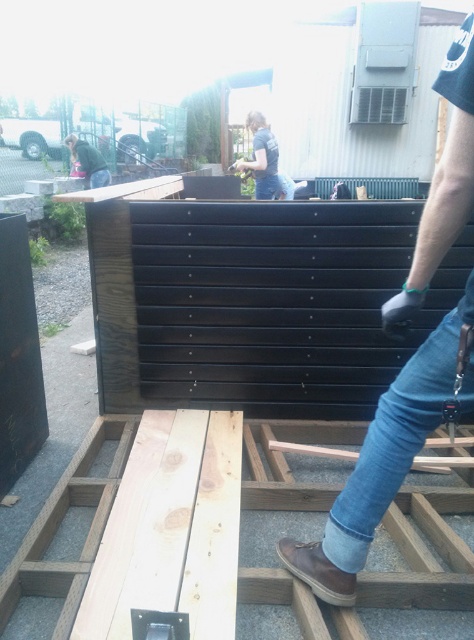
Consider the image. Does jeans at center have a greater height compared to green fabric jacket at upper left?

Correct, jeans at center is much taller as green fabric jacket at upper left.

Where is `jeans at center`? The image size is (474, 640). jeans at center is located at coordinates (382, 461).

The width and height of the screenshot is (474, 640). Identify the location of jeans at center. (382, 461).

You are a GUI agent. You are given a task and a screenshot of the screen. Output one action in this format:
    pyautogui.click(x=<x>, y=<y>)
    Task: Click on the jeans at center
    Image resolution: width=474 pixels, height=640 pixels.
    Given the screenshot: What is the action you would take?
    pyautogui.click(x=382, y=461)

Does jeans at center appear on the left side of denim jeans at upper center?

No, jeans at center is not to the left of denim jeans at upper center.

Who is more forward, (455, 209) or (266, 131)?

Positioned in front is point (455, 209).

Image resolution: width=474 pixels, height=640 pixels. In order to click on jeans at center in this screenshot , I will do `click(382, 461)`.

From the picture: Can you confirm if denim jeans at upper center is wider than green fabric jacket at upper left?

Incorrect, denim jeans at upper center's width does not surpass green fabric jacket at upper left's.

Who is positioned more to the right, denim jeans at upper center or green fabric jacket at upper left?

Positioned to the right is denim jeans at upper center.

Locate an element on the screen. The image size is (474, 640). denim jeans at upper center is located at coordinates (262, 157).

The image size is (474, 640). What are the coordinates of `denim jeans at upper center` in the screenshot? It's located at (262, 157).